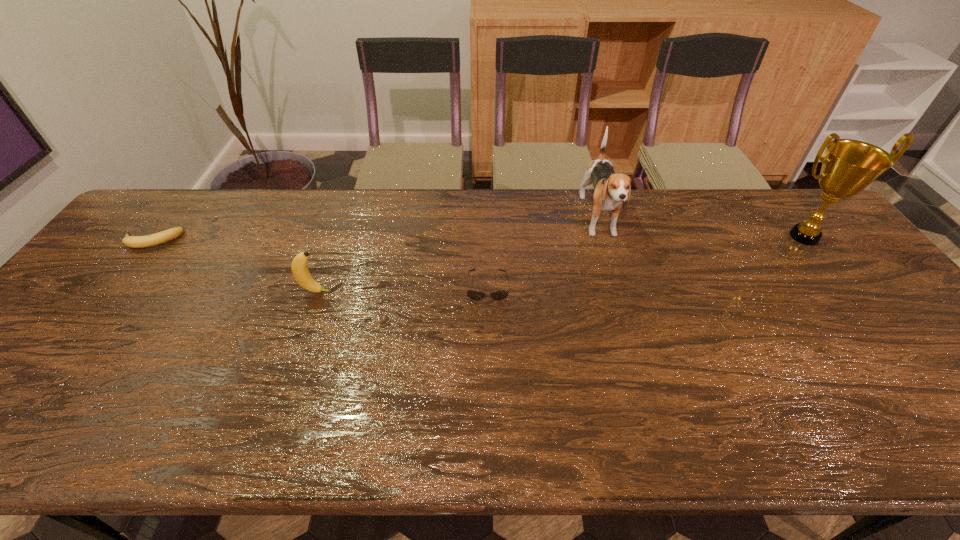
I want to click on object that is at the far right corner, so click(848, 166).

Find the location of a particular element. free space at the far edge of the desktop is located at coordinates (288, 227).

Locate an element on the screen. The image size is (960, 540). vacant space at the near edge is located at coordinates (97, 424).

The image size is (960, 540). Identify the location of free spot at the left edge of the desktop. (135, 288).

The height and width of the screenshot is (540, 960). In the image, there is a desktop. In order to click on free space at the right edge in this screenshot , I will do `click(838, 240)`.

The image size is (960, 540). What are the coordinates of `empty space that is in between the third shortest object and the tallest object` in the screenshot? It's located at (561, 264).

The height and width of the screenshot is (540, 960). In order to click on vacant area that lies between the leftmost object and the fourth shortest object in this screenshot , I will do `click(374, 231)`.

Locate an element on the screen. free space between the second tallest object and the leftmost object is located at coordinates [374, 231].

You are a GUI agent. You are given a task and a screenshot of the screen. Output one action in this format:
    pyautogui.click(x=<x>, y=<y>)
    Task: Click on the free space between the sunglasses and the farther banana
    This screenshot has height=540, width=960.
    Given the screenshot: What is the action you would take?
    pyautogui.click(x=319, y=263)

Find the location of a particular element. The image size is (960, 540). vacant area that lies between the second tallest object and the nearer banana is located at coordinates (458, 256).